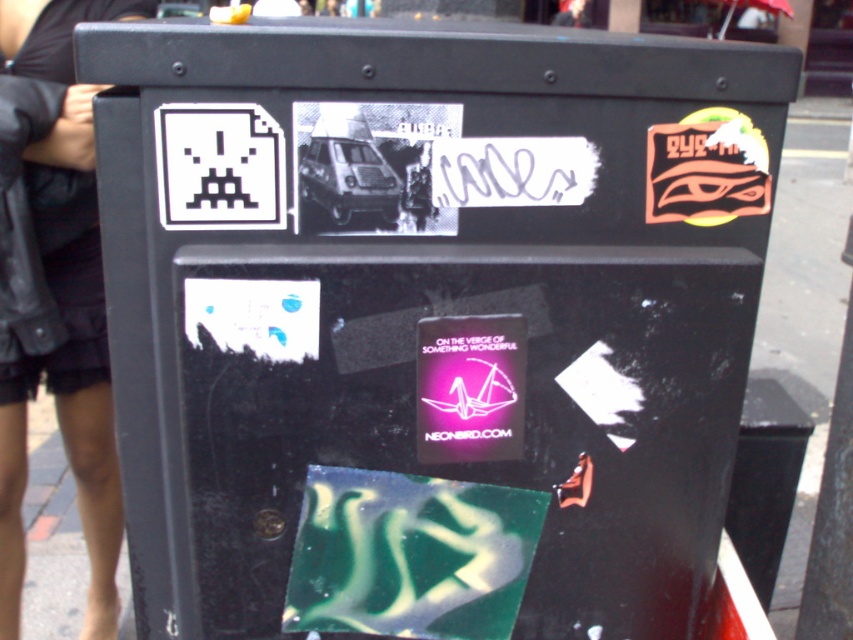
You are an artist planning to add a new sticker to the black utility box. You have a sticker of a black leather jacket at upper left and a white pixelated alien at upper left. Which sticker should you place first if you want to ensure the smaller one is fully visible?

The white pixelated alien at upper left is smaller than the black leather jacket at upper left, so you should place the white pixelated alien at upper left first to ensure it remains visible underneath the larger jacket sticker.

You are a graffiti artist who wants to add a new sticker between the black leather jacket at upper left and the white pixelated alien at upper left on the utility box. The new sticker is 18 inches wide. Is there enough space between them to fit the sticker without overlapping?

The distance between the black leather jacket at upper left and the white pixelated alien at upper left is 36.19 inches. Since the new sticker is 18 inches wide, there is sufficient space to place it between them without overlapping.

You are an art student analyzing the black utility box. You notice the black leather jacket at upper left and the white pixelated alien at upper left. Which object is closer to you on the utility box?

The black leather jacket at upper left is closer to you than the white pixelated alien at upper left.